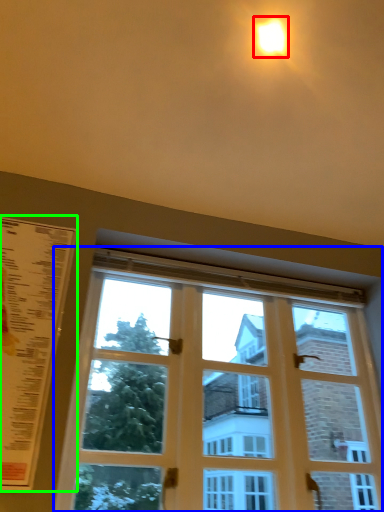
Question: Which is farther away from light (highlighted by a red box)? window (highlighted by a blue box) or menu (highlighted by a green box)?

Choices:
 (A) window
 (B) menu

Answer: (A)